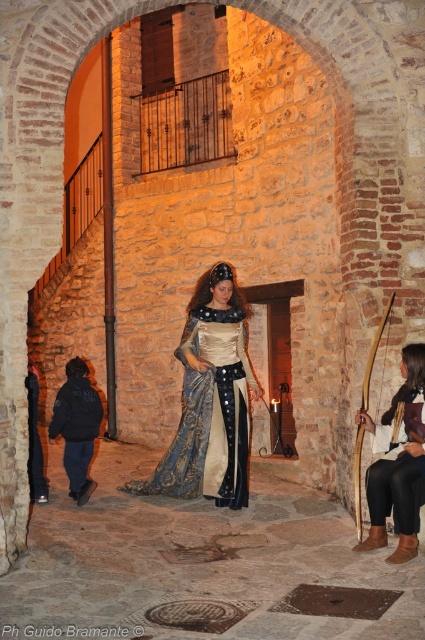
You are an event organizer planning to move the velvet blue dress at lower right closer to the wooden bow at center. Based on their current positions, which object would you need to adjust first to make space?

The velvet blue dress at lower right is in front of the wooden bow at center, so you would need to move the velvet blue dress at lower right first to create space.

You are a photographer positioned at the camera. You want to capture a closeup shot of the velvet blue dress at lower right. Given that your camera can focus on objects within 10 meters, will you be able to take the closeup shot?

The velvet blue dress at lower right is 19.48 meters away from the camera, which is beyond the camera focus range of 10 meters. Therefore, you cannot take the closeup shot.

You are an event planner organizing a historical reenactment. You need to place a decorative banner that is 1.2 meters wide. The banner must be hung at point (209, 417). Is there enough space for the banner at that location?

The banner cannot be placed at point (209, 417) because the silk satin dress at center is located there.